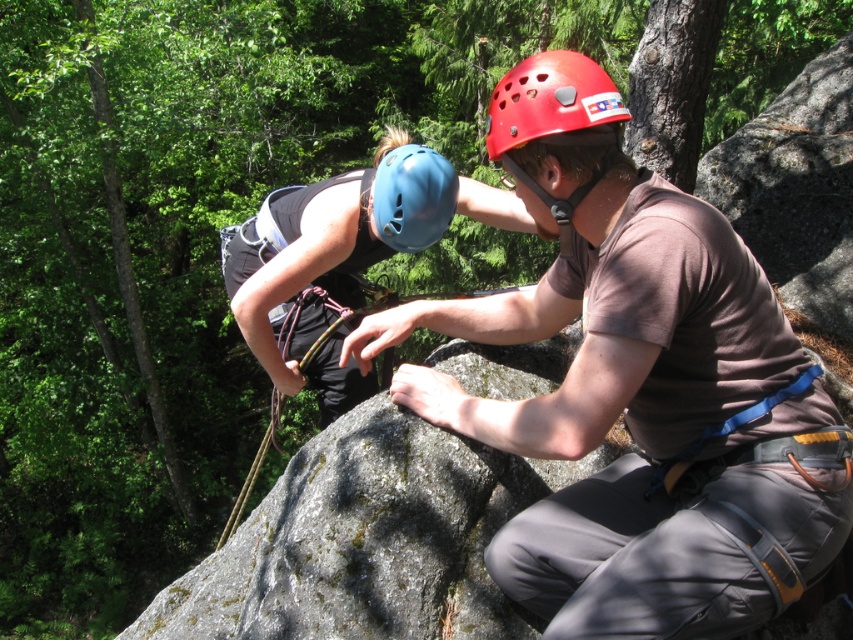
Question: Which point is farther to the camera?

Choices:
 (A) red matte helmet at center
 (B) matte brown shirt at center
 (C) blue matte helmet at center

Answer: (C)

Question: Does red matte helmet at center appear on the left side of blue matte helmet at center?

Choices:
 (A) no
 (B) yes

Answer: (A)

Question: Is matte brown shirt at center to the left of red matte helmet at center from the viewer's perspective?

Choices:
 (A) yes
 (B) no

Answer: (B)

Question: Based on their relative distances, which object is nearer to the blue matte helmet at center?

Choices:
 (A) matte brown shirt at center
 (B) red matte helmet at center

Answer: (B)

Question: Which is nearer to the blue matte helmet at center?

Choices:
 (A) matte brown shirt at center
 (B) red matte helmet at center

Answer: (B)

Question: Does matte brown shirt at center appear over blue matte helmet at center?

Choices:
 (A) yes
 (B) no

Answer: (B)